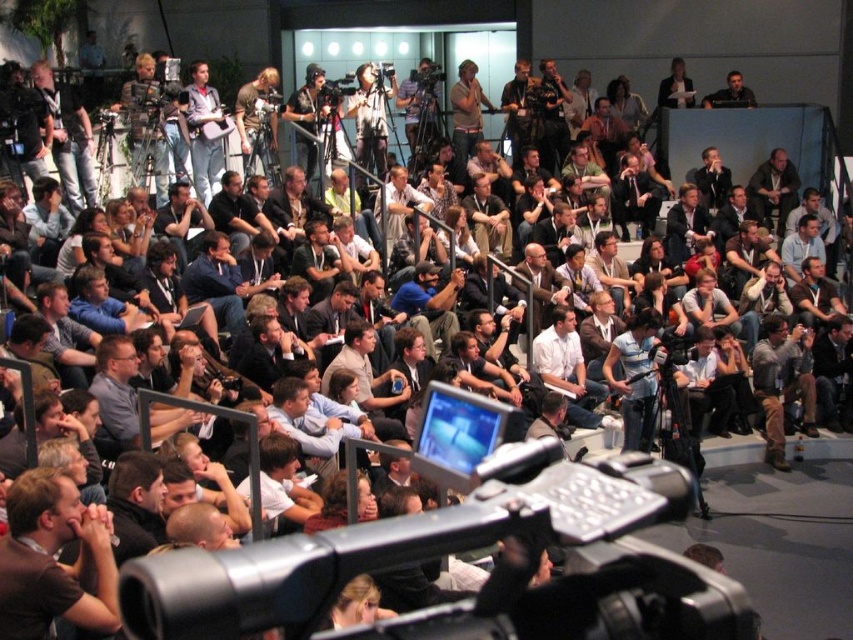
Question: Among these objects, which one is farthest from the camera?

Choices:
 (A) light brown hair at lower left
 (B) dark blue shirt at center

Answer: (B)

Question: In this image, where is white shirt at center located relative to dark blue shirt at center?

Choices:
 (A) above
 (B) below

Answer: (B)

Question: Considering the relative positions of gray shirt at center and dark gray shirt at upper right in the image provided, where is gray shirt at center located with respect to dark gray shirt at upper right?

Choices:
 (A) above
 (B) below

Answer: (B)

Question: Which point is farther from the camera taking this photo?

Choices:
 (A) (579, 561)
 (B) (773, 467)

Answer: (B)

Question: Which object appears closest to the camera in this image?

Choices:
 (A) light brown leather jacket at center
 (B) light brown hair at lower left
 (C) white shirt at center
 (D) dark gray shirt at upper right

Answer: (B)

Question: Is black plastic video camera at center smaller than white shirt at center?

Choices:
 (A) no
 (B) yes

Answer: (B)